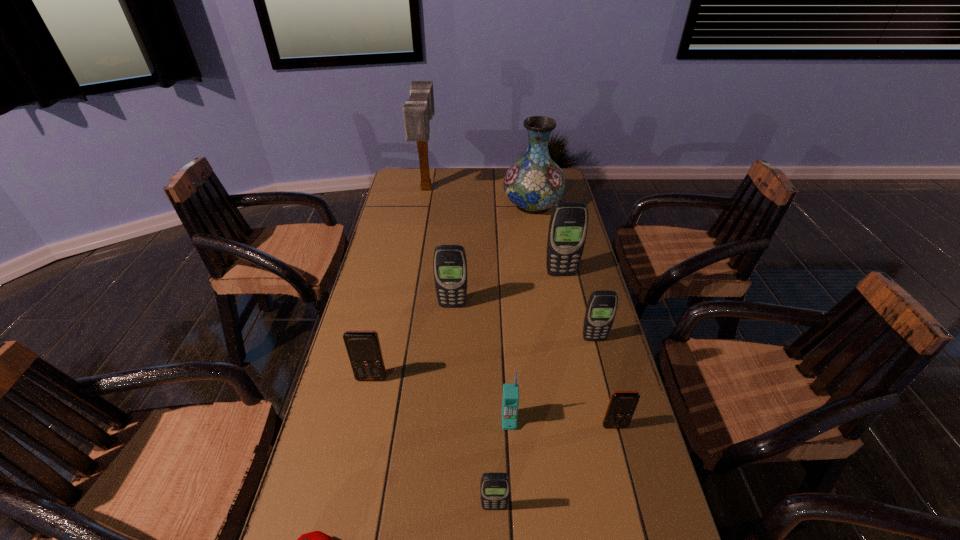
You are a GUI agent. You are given a task and a screenshot of the screen. Output one action in this format:
    pyautogui.click(x=<x>, y=<y>)
    Task: Click on the object that is the closest to the fifth nearest cellular telephone
    
    Given the screenshot: What is the action you would take?
    pyautogui.click(x=622, y=404)

Image resolution: width=960 pixels, height=540 pixels. Identify the location of object that is the second closest one to the fourth object from left to right. (568, 225).

This screenshot has width=960, height=540. I want to click on cellular telephone object that ranks as the seventh closest to the nearest object, so click(x=568, y=225).

Select which cellular telephone is the closest to the third farthest cellular telephone. Please provide its 2D coordinates. Your answer should be formatted as a tuple, i.e. [(x, y)], where the tuple contains the x and y coordinates of a point satisfying the conditions above.

[(622, 404)]

Find the location of a particular element. This screenshot has width=960, height=540. the closest gray cellular telephone to the sixth farthest object is located at coordinates (x=449, y=263).

Locate an element on the screen. This screenshot has width=960, height=540. gray cellular telephone that is the third closest to the fifth nearest object is located at coordinates (601, 308).